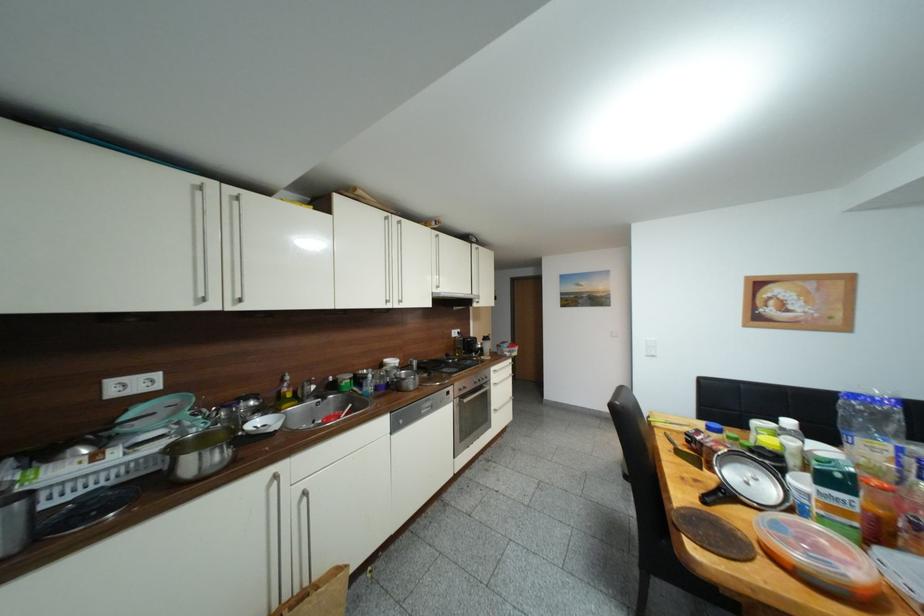
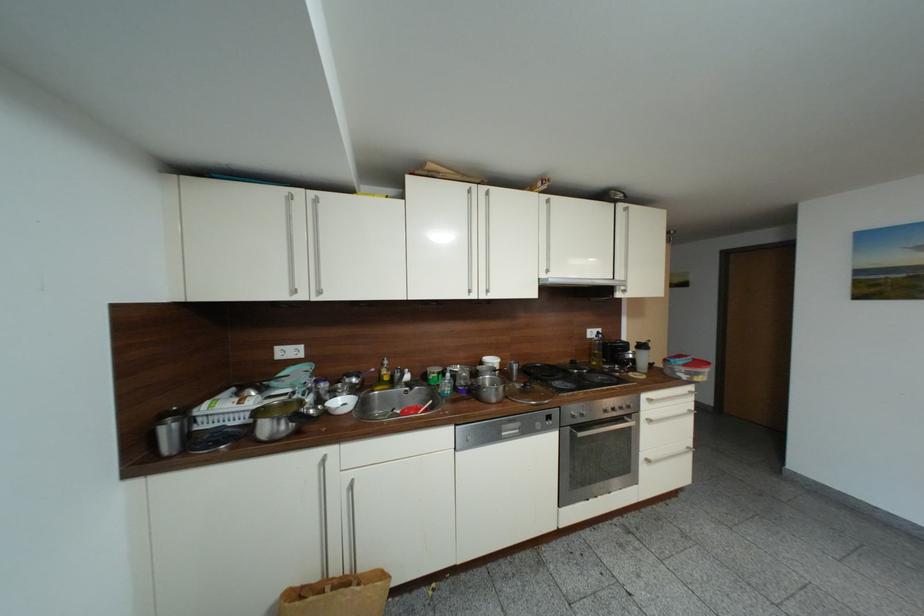
Question: Based on the continuous images, in which direction is the camera rotating? Reply with the corresponding letter.

Choices:
 (A) Left
 (B) Right
 (C) Up
 (D) Down

Answer: (A)